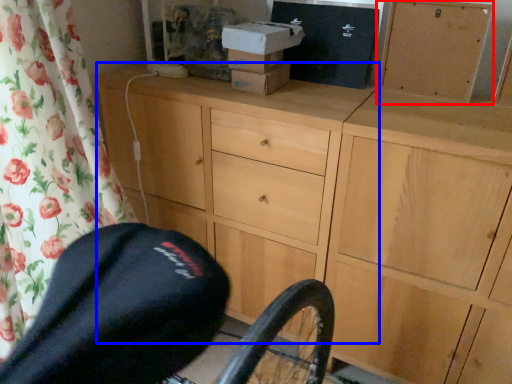
Question: Which object appears closest to the camera in this image, cabinetry (highlighted by a red box) or chest of drawers (highlighted by a blue box)?

Choices:
 (A) cabinetry
 (B) chest of drawers

Answer: (B)